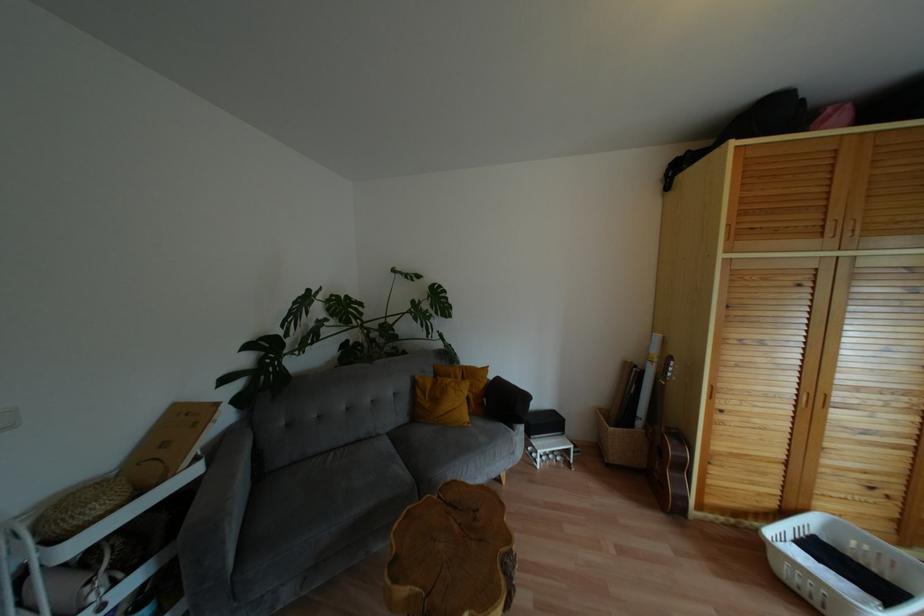
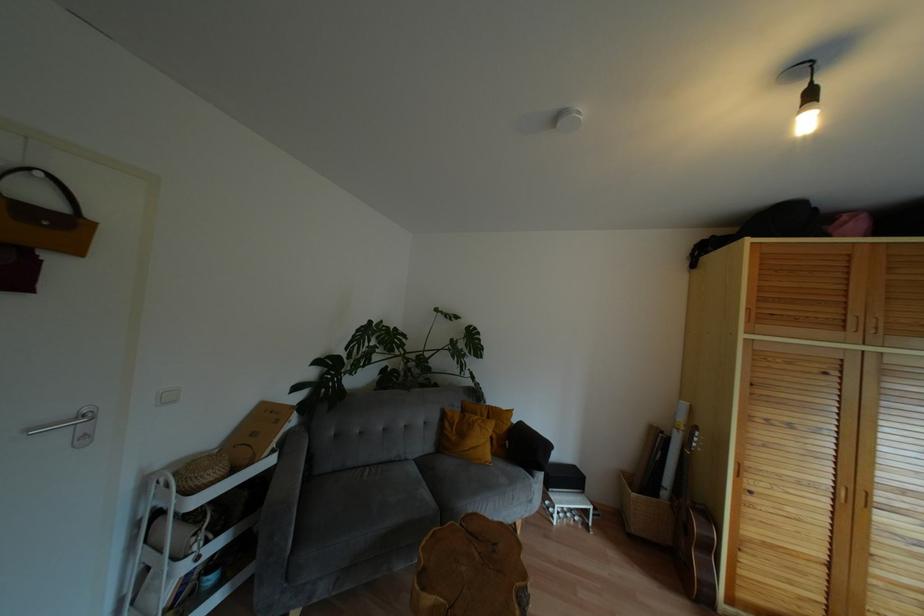
The point at [824,395] is marked in the first image. Where is the corresponding point in the second image?

(867, 493)